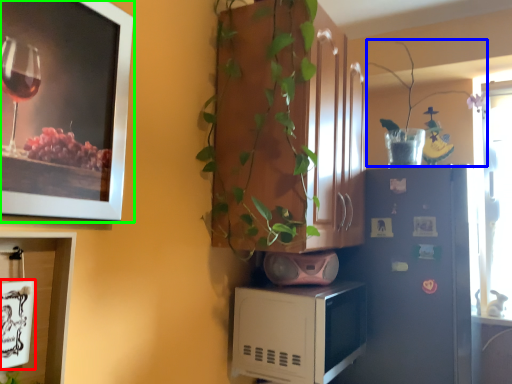
Question: Estimate the real-world distances between objects in this image. Which object is farther from picture frame (highlighted by a red box), plant (highlighted by a blue box) or picture frame (highlighted by a green box)?

Choices:
 (A) plant
 (B) picture frame

Answer: (A)